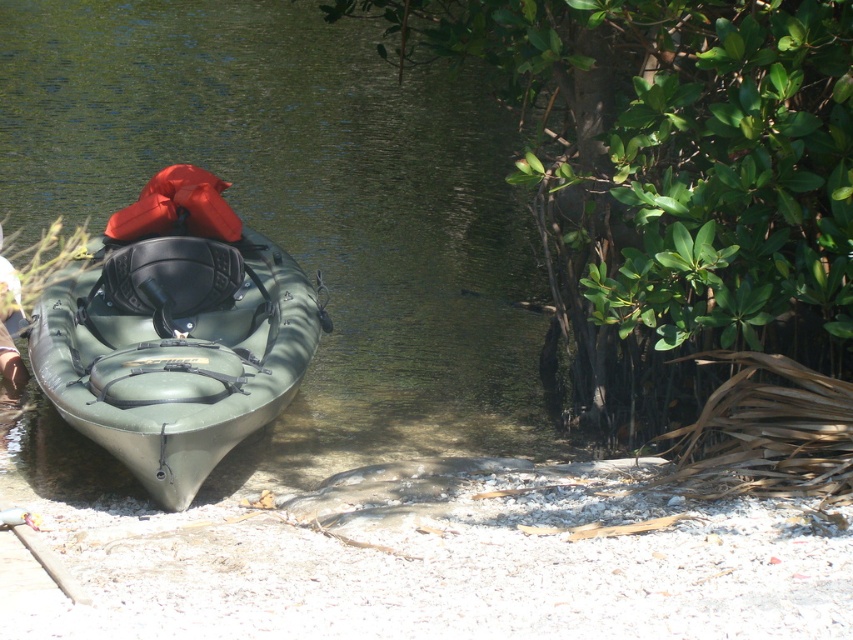
Can you confirm if matte green kayak at center is positioned to the right of orange matte life jacket at center?

Correct, you'll find matte green kayak at center to the right of orange matte life jacket at center.

Between matte green kayak at center and orange matte life jacket at center, which one has more height?

matte green kayak at center

Where is `matte green kayak at center`? The image size is (853, 640). matte green kayak at center is located at coordinates (177, 349).

This screenshot has height=640, width=853. What are the coordinates of `matte green kayak at center` in the screenshot? It's located at (177, 349).

Who is positioned more to the left, white sand at lower left or orange matte life jacket at center?

Positioned to the left is orange matte life jacket at center.

Between white sand at lower left and orange matte life jacket at center, which one is positioned lower?

white sand at lower left is below.

Which is behind, point (157, 618) or point (210, 179)?

The point (210, 179) is more distant.

Locate an element on the screen. The width and height of the screenshot is (853, 640). white sand at lower left is located at coordinates (440, 561).

From the picture: Which is above, white sand at lower left or light brown leather shoe at lower left?

light brown leather shoe at lower left

Is white sand at lower left bigger than light brown leather shoe at lower left?

Yes.

Identify the location of white sand at lower left. This screenshot has width=853, height=640. (440, 561).